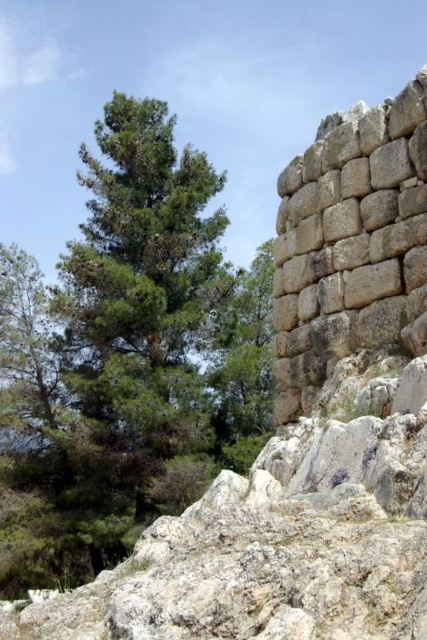
You are standing at the center of the image and want to find the green leafy tree at upper left. In which direction should you look to see it?

The green leafy tree at upper left is located at point [126,358] in the image, so you should look towards the upper left direction to see it.

You are a hiker who wants to take a photo of the natural stone wall at right but also wants to include the green leafy tree at upper left in the frame. Given their sizes, will you need to move closer or farther away from the wall to ensure both are fully visible in the photo?

The green leafy tree at upper left is larger in size than the natural stone wall at right. To include both in the frame, you should move farther away from the wall so that the larger tree and the smaller wall can fit within the camera view.

You are standing in front of the ancient stone structure and want to determine the relative positions of two points marked on the structure. The first point is at coordinates point (175, 435) and the second is at point (380, 336). Which point is closer to you?

Point (175, 435) is closer to you because it is further to the camera than point (380, 336).